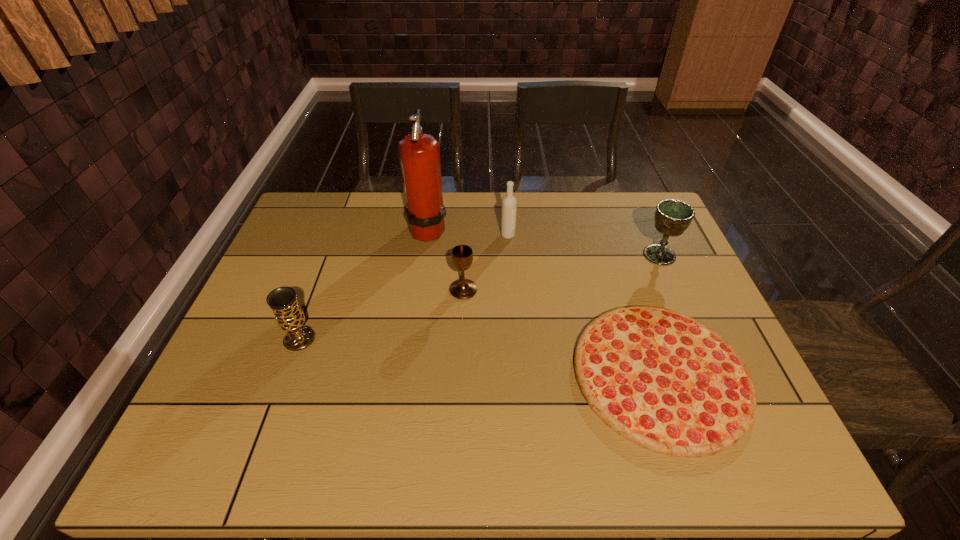
Identify the location of pizza that is positioned at the right edge. This screenshot has width=960, height=540. (663, 380).

The width and height of the screenshot is (960, 540). I want to click on object that is at the near right corner, so click(663, 380).

The image size is (960, 540). I want to click on free space at the far edge of the desktop, so click(x=616, y=223).

Image resolution: width=960 pixels, height=540 pixels. I want to click on vacant space at the near edge of the desktop, so click(x=567, y=456).

This screenshot has width=960, height=540. What are the coordinates of `free space at the left edge of the desktop` in the screenshot? It's located at (282, 346).

The height and width of the screenshot is (540, 960). In the image, there is a desktop. What are the coordinates of `vacant space at the far left corner` in the screenshot? It's located at (325, 198).

The width and height of the screenshot is (960, 540). In order to click on vacant space at the far right corner of the desktop in this screenshot , I will do `click(659, 202)`.

What are the coordinates of `free point between the rightmost chalice and the tallest object` in the screenshot? It's located at (543, 241).

Find the location of a particular element. Image resolution: width=960 pixels, height=540 pixels. free space between the leftmost object and the fourth object from right to left is located at coordinates (381, 314).

You are a GUI agent. You are given a task and a screenshot of the screen. Output one action in this format:
    pyautogui.click(x=<x>, y=<y>)
    Task: Click on the free spot between the third object from right to left and the second nearest chalice
    This screenshot has height=540, width=960.
    Given the screenshot: What is the action you would take?
    pyautogui.click(x=486, y=262)